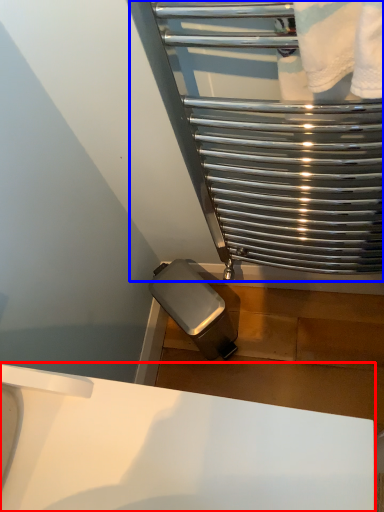
Question: Which object appears farthest to the camera in this image, sink (highlighted by a red box) or glass door (highlighted by a blue box)?

Choices:
 (A) sink
 (B) glass door

Answer: (B)